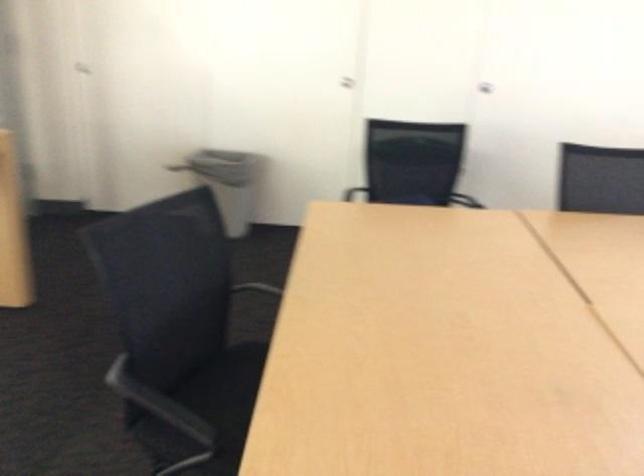
You are a GUI agent. You are given a task and a screenshot of the screen. Output one action in this format:
    pyautogui.click(x=<x>, y=<y>)
    Task: Click on the chair sitting surface
    This screenshot has width=644, height=476.
    Given the screenshot: What is the action you would take?
    pyautogui.click(x=227, y=380)